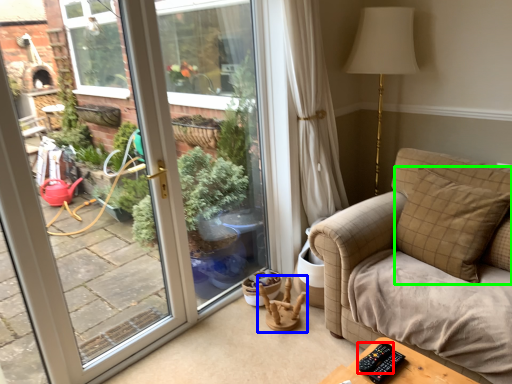
Question: Considering the real-world distances, which object is farthest from remote (highlighted by a red box)? rocking chair (highlighted by a blue box) or pillow (highlighted by a green box)?

Choices:
 (A) rocking chair
 (B) pillow

Answer: (A)